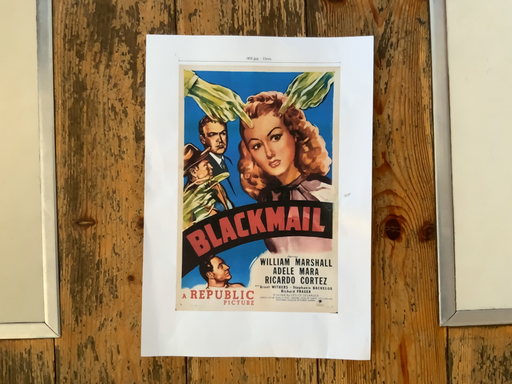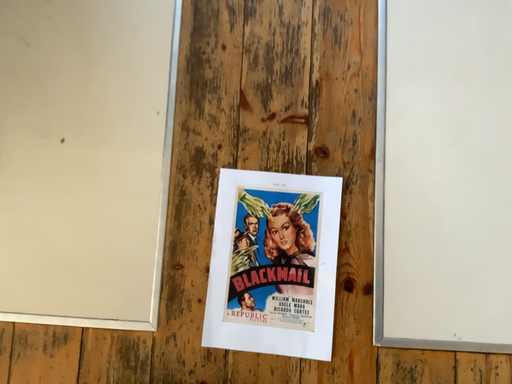
Question: How did the camera likely rotate when shooting the video?

Choices:
 (A) rotated upward
 (B) rotated downward

Answer: (A)